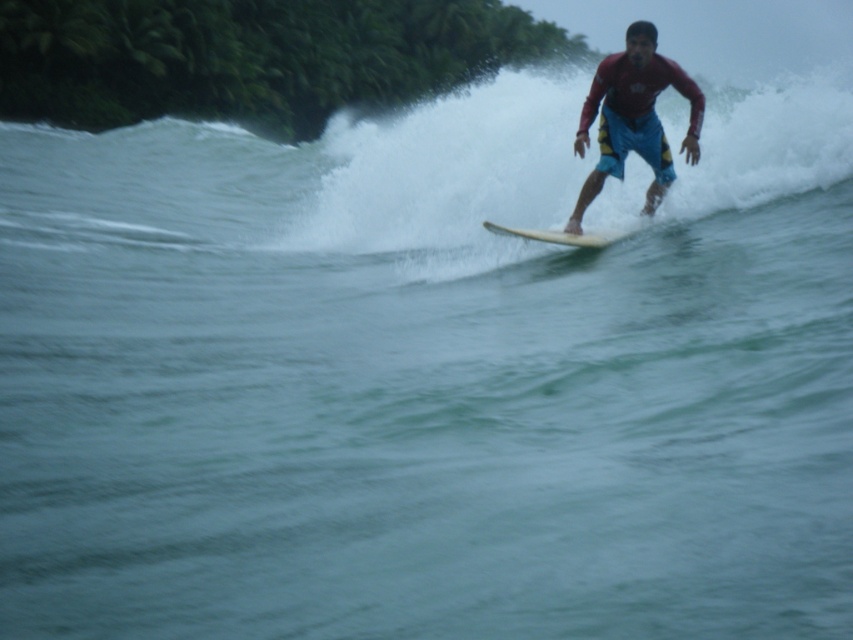
Looking at this image, you are a photographer trying to capture the surfer and the wave. Based on the scene, which object is closer to the camera between the white foamy wave at upper center and the white smooth surfboard at center?

The white foamy wave at upper center is in front of the white smooth surfboard at center, so it is closer to the camera.

You are a drone operator trying to capture the surfer in the image. The surfer is at point (642, 22). You need to adjust your drone to maintain a safe distance of at least 10 meters from the surfer to avoid interference. Is your current position at 11.11 meters sufficient?

The distance between the point (642, 22) and the camera is 11.11 meters, which is more than the required 10 meters. Therefore, the current position is sufficient to maintain a safe distance.

You are a surfer who wants to choose a surfboard that is bigger in size. Based on the image, which one should you pick between the red matte surfboard at upper right and the white smooth surfboard at center?

The red matte surfboard at upper right is larger in size compared to the white smooth surfboard at center, so you should pick the red matte surfboard at upper right.